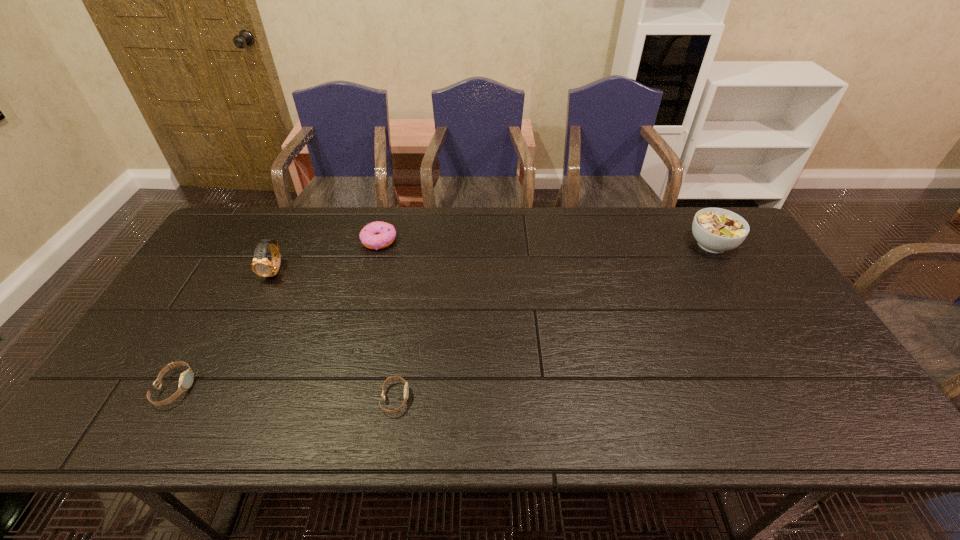
Where is `vacant space located on the front of the soup bowl`? This screenshot has height=540, width=960. vacant space located on the front of the soup bowl is located at coordinates (757, 323).

Locate an element on the screen. The width and height of the screenshot is (960, 540). free region located on the right of the doughnut is located at coordinates (444, 240).

Where is `vacant space located 0.200m on the face of the leftmost watch`? The height and width of the screenshot is (540, 960). vacant space located 0.200m on the face of the leftmost watch is located at coordinates (276, 388).

The width and height of the screenshot is (960, 540). I want to click on vacant space situated 0.170m on the face of the shortest object, so click(482, 399).

Where is `soup bowl that is at the far edge`? Image resolution: width=960 pixels, height=540 pixels. soup bowl that is at the far edge is located at coordinates (716, 230).

In order to click on doughnut at the far edge in this screenshot , I will do `click(376, 235)`.

You are a GUI agent. You are given a task and a screenshot of the screen. Output one action in this format:
    pyautogui.click(x=<x>, y=<y>)
    Task: Click on the object at the left edge
    
    Given the screenshot: What is the action you would take?
    pyautogui.click(x=186, y=378)

What are the coordinates of `object that is at the right edge` in the screenshot? It's located at (716, 230).

Identify the location of object that is at the near left corner. (186, 378).

What are the coordinates of `object present at the far right corner` in the screenshot? It's located at (716, 230).